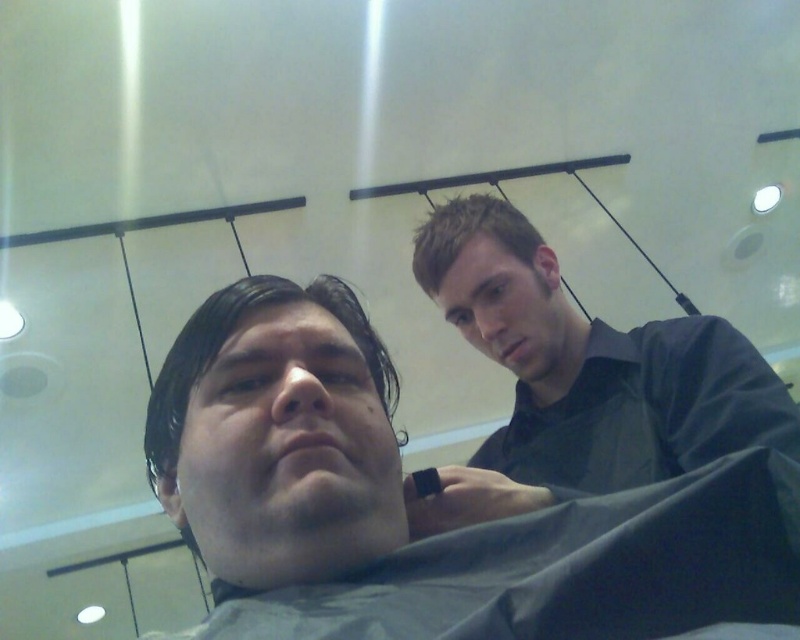
Question: Estimate the real-world distances between objects in this image. Which object is closer to the smooth gray shirt at center?

Choices:
 (A) dark gray shirt at upper right
 (B) short brown hair at upper center

Answer: (A)

Question: Which object is closer to the camera taking this photo?

Choices:
 (A) smooth gray shirt at center
 (B) short brown hair at upper center
 (C) dark gray shirt at upper right

Answer: (A)

Question: Estimate the real-world distances between objects in this image. Which object is farther from the short brown hair at upper center?

Choices:
 (A) smooth gray shirt at center
 (B) dark gray shirt at upper right

Answer: (A)

Question: Is smooth gray shirt at center further to the viewer compared to dark gray shirt at upper right?

Choices:
 (A) no
 (B) yes

Answer: (A)

Question: Is smooth gray shirt at center wider than short brown hair at upper center?

Choices:
 (A) yes
 (B) no

Answer: (A)

Question: Can you confirm if dark gray shirt at upper right is positioned to the left of short brown hair at upper center?

Choices:
 (A) no
 (B) yes

Answer: (A)